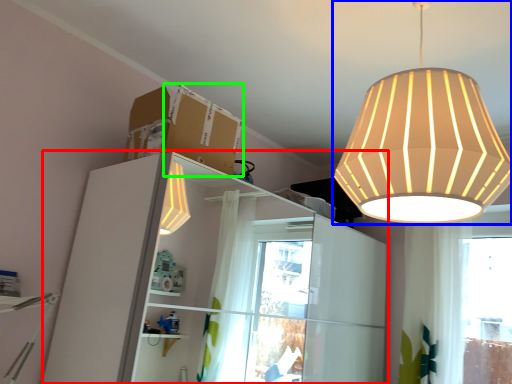
Question: Which is nearer to the dresser (highlighted by a red box)? lamp (highlighted by a blue box) or cardboard box (highlighted by a green box).

Choices:
 (A) lamp
 (B) cardboard box

Answer: (B)